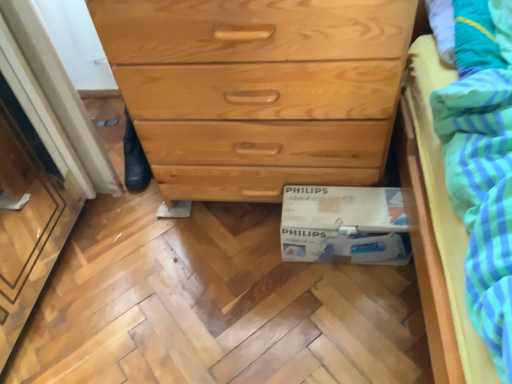
Identify the location of vacant space in front of natural wood chest of drawers at center. Image resolution: width=512 pixels, height=384 pixels. (257, 304).